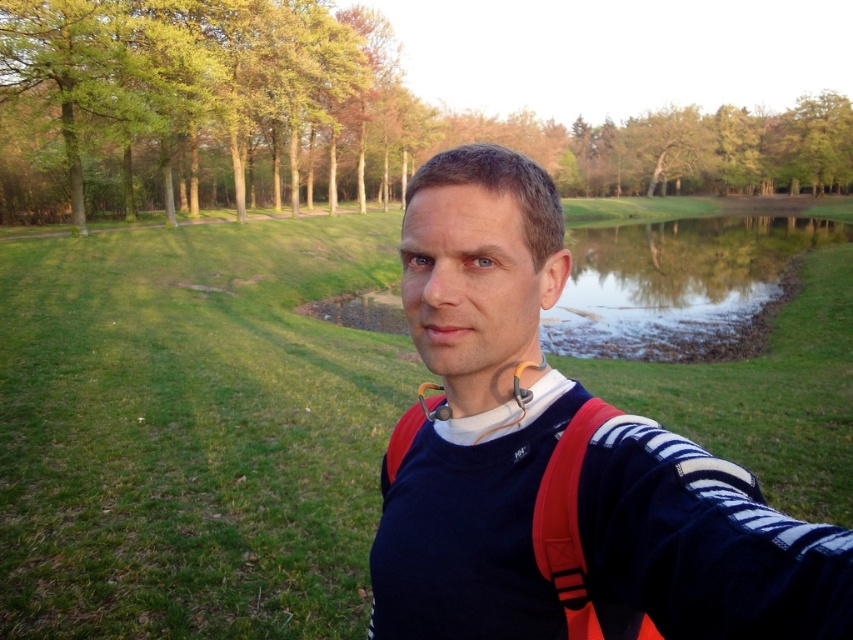
You are an observer standing at the same position as the person in the image. If you look down at the navy blue sweater at center and then glance towards the clear water at pond right, which object appears taller from your perspective?

The clear water at pond right appears taller than the navy blue sweater at center because the navy blue sweater at center is shorter than clear water at pond right.

You are standing in the serene outdoor scene and want to take a selfie with the green leafy tree at upper center in the background. Since the tree is at a specific coordinate, can you estimate its position relative to the pond?

The green leafy tree at upper center is located at point 0.184 on the x axis and 0.377 on the y axis, which places it above and to the left of the pond in the background.